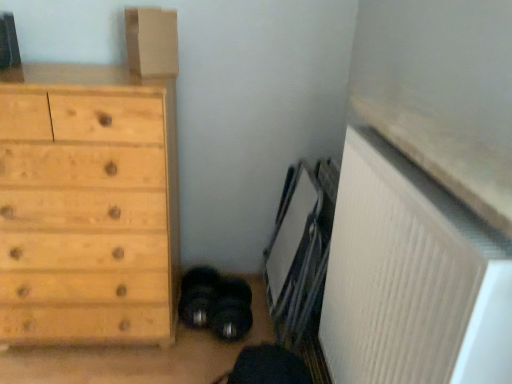
Question: Considering the relative positions of white ribbed radiator at lower right and matte cardboard box at upper left in the image provided, is white ribbed radiator at lower right to the left or to the right of matte cardboard box at upper left?

Choices:
 (A) left
 (B) right

Answer: (B)

Question: Looking at the image, does white ribbed radiator at lower right seem bigger or smaller compared to matte cardboard box at upper left?

Choices:
 (A) small
 (B) big

Answer: (B)

Question: Which of these objects is positioned closest to the natural wood chest of drawers at left?

Choices:
 (A) white ribbed radiator at lower right
 (B) matte cardboard box at upper left

Answer: (B)

Question: Estimate the real-world distances between objects in this image. Which object is closer to the white ribbed radiator at lower right?

Choices:
 (A) natural wood chest of drawers at left
 (B) matte cardboard box at upper left

Answer: (A)